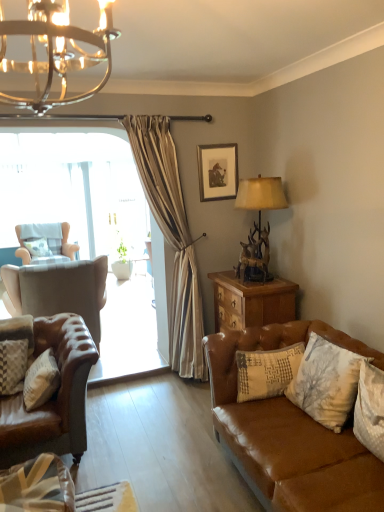
Question: From a real-world perspective, is leather armchair at left, the second chair in the back-to-front sequence, physically above white textured pillow at lower right, the 4th pillow when ordered from back to front?

Choices:
 (A) no
 (B) yes

Answer: (A)

Question: Considering the relative positions of leather armchair at left, acting as the second chair starting from the left, and white textured pillow at lower right, the 1th pillow when ordered from right to left, in the image provided, is leather armchair at left, acting as the second chair starting from the left, to the left of white textured pillow at lower right, the 1th pillow when ordered from right to left, from the viewer's perspective?

Choices:
 (A) yes
 (B) no

Answer: (A)

Question: From a real-world perspective, is leather armchair at left, which appears as the first chair when viewed from the right, below white textured pillow at lower right, arranged as the 5th pillow when viewed from the left?

Choices:
 (A) no
 (B) yes

Answer: (B)

Question: Is white textured pillow at lower right, arranged as the 5th pillow when viewed from the left, inside leather armchair at left, which ranks as the 1th chair in front-to-back order?

Choices:
 (A) no
 (B) yes

Answer: (A)

Question: Is leather armchair at left, acting as the second chair starting from the left, with white textured pillow at lower right, arranged as the 5th pillow when viewed from the left?

Choices:
 (A) no
 (B) yes

Answer: (A)

Question: From the image's perspective, relative to light beige fabric wingback chair at left, the 2th chair in the right-to-left sequence, is white textured pillow at lower right, arranged as the 2th pillow when viewed from the right, above or below?

Choices:
 (A) below
 (B) above

Answer: (A)

Question: Relative to light beige fabric wingback chair at left, arranged as the second chair when viewed from the front, is white textured pillow at lower right, acting as the third pillow starting from the front, in front or behind?

Choices:
 (A) behind
 (B) front

Answer: (B)

Question: Considering the positions of white textured pillow at lower right, arranged as the 2th pillow when viewed from the right, and light beige fabric wingback chair at left, arranged as the second chair when viewed from the front, in the image, is white textured pillow at lower right, arranged as the 2th pillow when viewed from the right, wider or thinner than light beige fabric wingback chair at left, arranged as the second chair when viewed from the front,?

Choices:
 (A) wide
 (B) thin

Answer: (B)

Question: Is white textured pillow at lower right, marked as the 4th pillow in a left-to-right arrangement, to the left or to the right of light beige fabric wingback chair at left, acting as the 1th chair starting from the left, in the image?

Choices:
 (A) left
 (B) right

Answer: (B)

Question: Relative to leather armchair at left, the second chair in the back-to-front sequence, is white textured pillow at lower right, arranged as the 5th pillow when viewed from the left, in front or behind?

Choices:
 (A) front
 (B) behind

Answer: (A)

Question: From a real-world perspective, is white textured pillow at lower right, which is the second pillow in front-to-back order, positioned above or below leather armchair at left, which ranks as the 1th chair in front-to-back order?

Choices:
 (A) below
 (B) above

Answer: (B)

Question: Looking at their shapes, would you say white textured pillow at lower right, the 1th pillow when ordered from right to left, is wider or thinner than leather armchair at left, acting as the second chair starting from the left?

Choices:
 (A) wide
 (B) thin

Answer: (B)

Question: From the image's perspective, is white textured pillow at lower right, which is the second pillow in front-to-back order, above or below leather armchair at left, acting as the second chair starting from the left?

Choices:
 (A) below
 (B) above

Answer: (A)

Question: Looking at the image, does brown leather couch at lower right seem bigger or smaller compared to brown wood nightstand at right?

Choices:
 (A) small
 (B) big

Answer: (B)

Question: From the image's perspective, is brown leather couch at lower right above or below brown wood nightstand at right?

Choices:
 (A) above
 (B) below

Answer: (B)